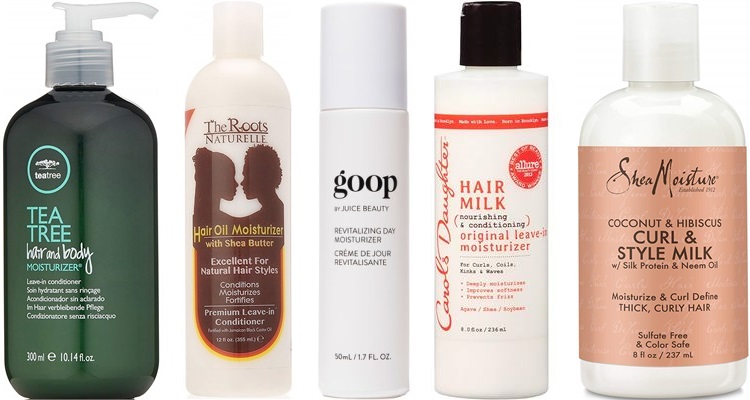
Identify the location of bottles standing up right. The height and width of the screenshot is (400, 750). (70, 260), (238, 218), (382, 209), (501, 226), (652, 220).